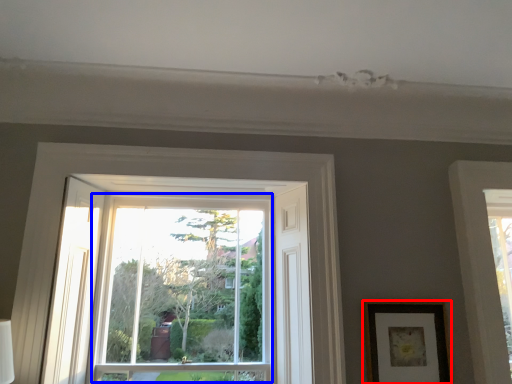
Question: Which object appears farthest to the camera in this image, picture frame (highlighted by a red box) or bay window (highlighted by a blue box)?

Choices:
 (A) picture frame
 (B) bay window

Answer: (B)